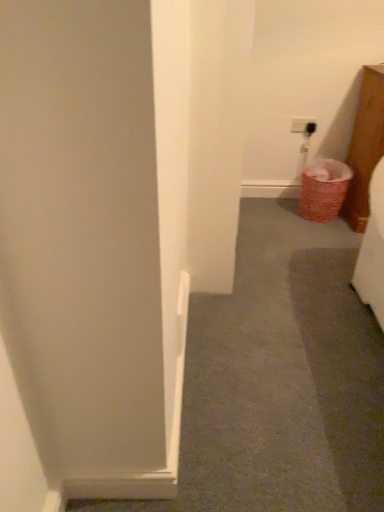
Measure the distance between woven brown laundry basket at lower right and camera.

The depth of woven brown laundry basket at lower right is 2.32 meters.

The image size is (384, 512). What are the coordinates of `woven brown laundry basket at lower right` in the screenshot? It's located at (323, 189).

What do you see at coordinates (323, 189) in the screenshot? I see `woven brown laundry basket at lower right` at bounding box center [323, 189].

What is the approximate height of woven brown laundry basket at lower right?

woven brown laundry basket at lower right is 13.10 inches in height.

The width and height of the screenshot is (384, 512). Describe the element at coordinates (280, 380) in the screenshot. I see `white smooth door at center` at that location.

Consider the image. Measure the distance between white smooth door at center and camera.

A distance of 1.12 meters exists between white smooth door at center and camera.

Where is `white smooth door at center`? The height and width of the screenshot is (512, 384). white smooth door at center is located at coordinates (280, 380).

Locate an element on the screen. woven brown laundry basket at lower right is located at coordinates (323, 189).

Which object is positioned more to the left, woven brown laundry basket at lower right or white smooth door at center?

From the viewer's perspective, white smooth door at center appears more on the left side.

Does woven brown laundry basket at lower right come in front of white smooth door at center?

No.

Considering the points (312, 162) and (205, 308), which point is in front, point (312, 162) or point (205, 308)?

The point (205, 308) is closer.

From the image's perspective, who appears lower, woven brown laundry basket at lower right or white smooth door at center?

white smooth door at center, from the image's perspective.

In the scene shown: From a real-world perspective, relative to white smooth door at center, is woven brown laundry basket at lower right vertically above or below?

woven brown laundry basket at lower right is situated higher than white smooth door at center in the real world.

Which of these two, woven brown laundry basket at lower right or white smooth door at center, is thinner?

woven brown laundry basket at lower right.

Can you confirm if woven brown laundry basket at lower right is taller than white smooth door at center?

Yes.

Which of these two, woven brown laundry basket at lower right or white smooth door at center, is smaller?

woven brown laundry basket at lower right.

Choose the correct answer: Is woven brown laundry basket at lower right inside white smooth door at center or outside it?

woven brown laundry basket at lower right exists outside the volume of white smooth door at center.

Is woven brown laundry basket at lower right far away from white smooth door at center?

No, woven brown laundry basket at lower right is in close proximity to white smooth door at center.

Is woven brown laundry basket at lower right positioned with its back to white smooth door at center?

woven brown laundry basket at lower right is not turned away from white smooth door at center.

How different are the orientations of woven brown laundry basket at lower right and white smooth door at center in degrees?

89.7 degrees separate the facing orientations of woven brown laundry basket at lower right and white smooth door at center.

How much distance is there between woven brown laundry basket at lower right and white smooth door at center?

woven brown laundry basket at lower right is 32.70 inches from white smooth door at center.

At what (x,y) coordinates should I click in order to perform the action: click on laundry basket above the white smooth door at center (from the image's perspective). Please return your answer as a coordinate pair (x, y). This screenshot has width=384, height=512. Looking at the image, I should click on (323, 189).

Which object is positioned more to the left, white smooth door at center or woven brown laundry basket at lower right?

Positioned to the left is white smooth door at center.

Considering the positions of objects white smooth door at center and woven brown laundry basket at lower right in the image provided, who is in front, white smooth door at center or woven brown laundry basket at lower right?

white smooth door at center is closer to the camera.

Does point (324, 324) come behind point (335, 184)?

No, it is not.

From the image's perspective, does white smooth door at center appear lower than woven brown laundry basket at lower right?

Yes, from the image's perspective, white smooth door at center is beneath woven brown laundry basket at lower right.

From a real-world perspective, is white smooth door at center physically located above or below woven brown laundry basket at lower right?

From a real-world perspective, white smooth door at center is physically below woven brown laundry basket at lower right.

Which of these two, white smooth door at center or woven brown laundry basket at lower right, is wider?

Wider between the two is white smooth door at center.

In terms of height, does white smooth door at center look taller or shorter compared to woven brown laundry basket at lower right?

Clearly, white smooth door at center is shorter compared to woven brown laundry basket at lower right.

Looking at this image, is white smooth door at center bigger or smaller than woven brown laundry basket at lower right?

Considering their sizes, white smooth door at center takes up more space than woven brown laundry basket at lower right.

Is white smooth door at center completely or partially outside of woven brown laundry basket at lower right?

white smooth door at center is positioned outside woven brown laundry basket at lower right.

Is white smooth door at center not close to woven brown laundry basket at lower right?

That's not correct — white smooth door at center is a little close to woven brown laundry basket at lower right.

Does white smooth door at center turn towards woven brown laundry basket at lower right?

No, white smooth door at center is not aimed at woven brown laundry basket at lower right.

Where is `path below the woven brown laundry basket at lower right (from the image's perspective)`? Image resolution: width=384 pixels, height=512 pixels. path below the woven brown laundry basket at lower right (from the image's perspective) is located at coordinates (280, 380).

The height and width of the screenshot is (512, 384). I want to click on path that appears in front of the woven brown laundry basket at lower right, so click(280, 380).

Locate an element on the screen. laundry basket to the right of white smooth door at center is located at coordinates click(323, 189).